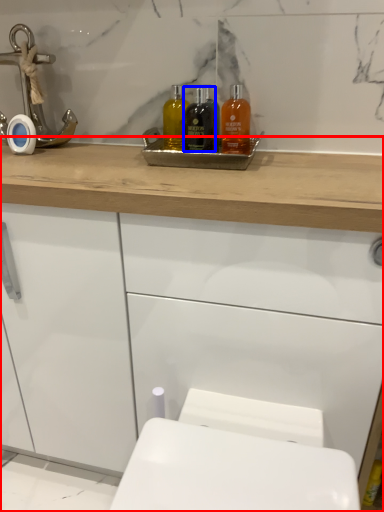
Question: Which point is closer to the camera, bathroom cabinet (highlighted by a red box) or mouthwash (highlighted by a blue box)?

Choices:
 (A) bathroom cabinet
 (B) mouthwash

Answer: (A)